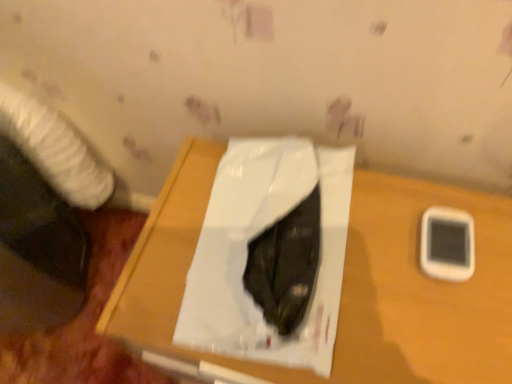
Question: Do you think white glossy paper at center is within wooden table at center, or outside of it?

Choices:
 (A) outside
 (B) inside

Answer: (B)

Question: Based on their sizes in the image, would you say white glossy paper at center is bigger or smaller than wooden table at center?

Choices:
 (A) small
 (B) big

Answer: (A)

Question: Estimate the real-world distances between objects in this image. Which object is farther from the white plastic mobile phone at right?

Choices:
 (A) wooden table at center
 (B) white glossy paper at center

Answer: (B)

Question: Which is nearer to the white plastic mobile phone at right?

Choices:
 (A) wooden table at center
 (B) white glossy paper at center

Answer: (A)